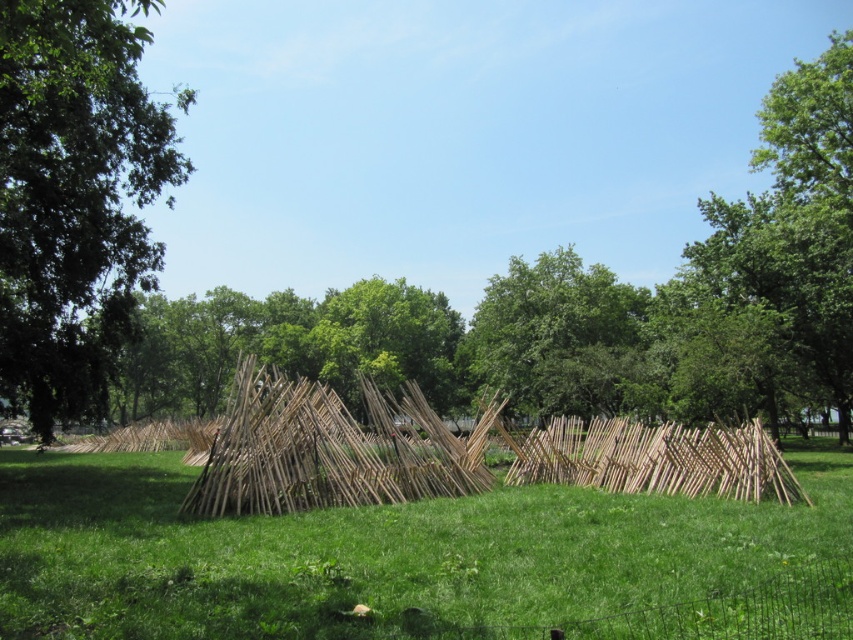
Between green grassy at center and natural wood reed at center, which one is positioned lower?

natural wood reed at center is lower down.

Can you confirm if green grassy at center is positioned to the right of natural wood reed at center?

No, green grassy at center is not to the right of natural wood reed at center.

Where is `green grassy at center`? The height and width of the screenshot is (640, 853). green grassy at center is located at coordinates 384,554.

Does green leafy tree at left appear under green leafy tree at center?

No.

Looking at this image, between green leafy tree at left and green leafy tree at center, which one has more height?

With more height is green leafy tree at left.

This screenshot has height=640, width=853. What are the coordinates of `green leafy tree at left` in the screenshot? It's located at (74, 198).

Is green grassy at center positioned behind green leafy tree at left?

No, it is in front of green leafy tree at left.

Does point (421, 547) come behind point (148, 262)?

No.

Where is `green grassy at center`? The height and width of the screenshot is (640, 853). green grassy at center is located at coordinates (384, 554).